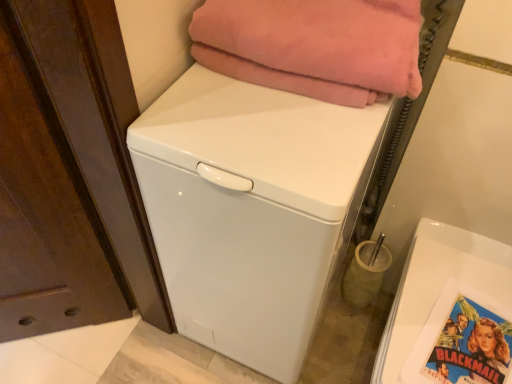
Question: From their relative heights in the image, would you say white glossy washing machine at center is taller or shorter than blue glossy comic book at lower right?

Choices:
 (A) tall
 (B) short

Answer: (A)

Question: From a real-world perspective, is white glossy washing machine at center physically located above or below blue glossy comic book at lower right?

Choices:
 (A) above
 (B) below

Answer: (B)

Question: Which object is the farthest from the pink fleece blanket at upper center?

Choices:
 (A) blue glossy comic book at lower right
 (B) white glossy washing machine at center

Answer: (A)

Question: Which is farther from the blue glossy comic book at lower right?

Choices:
 (A) pink fleece blanket at upper center
 (B) white glossy washing machine at center

Answer: (A)